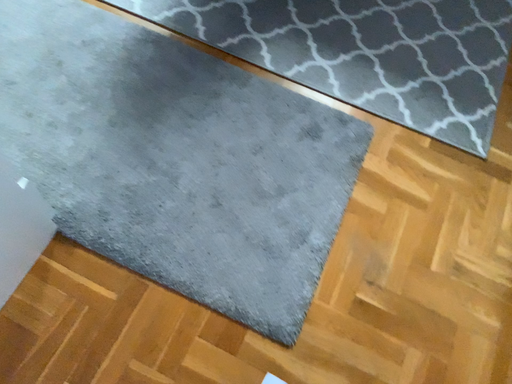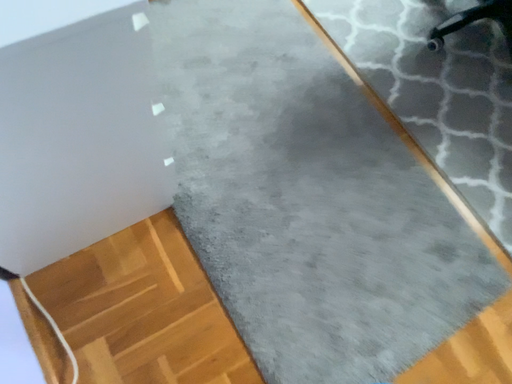
Question: Which way did the camera rotate in the video?

Choices:
 (A) rotated left
 (B) rotated right

Answer: (A)